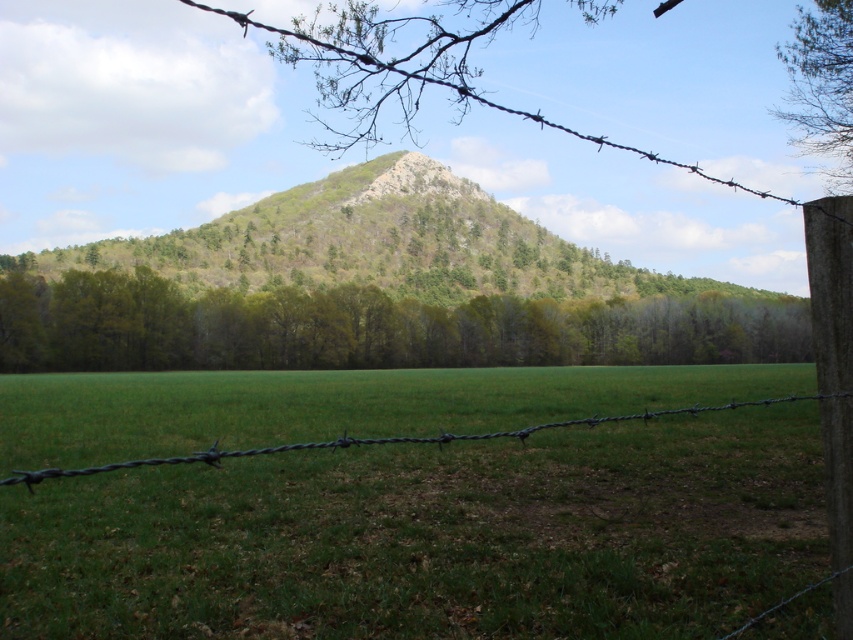
Question: Which of the following is the farthest from the observer?

Choices:
 (A) green grass at center
 (B) green leafy tree at upper right

Answer: (B)

Question: Is green grass at center below green textured hill at center?

Choices:
 (A) yes
 (B) no

Answer: (A)

Question: Which object is farther from the camera taking this photo?

Choices:
 (A) green leafy trees at center
 (B) green leafy tree at upper right

Answer: (A)

Question: Among these points, which one is nearest to the camera?

Choices:
 (A) (691, 538)
 (B) (299, 260)

Answer: (A)

Question: Can you confirm if green grass at center is positioned above green textured hill at center?

Choices:
 (A) yes
 (B) no

Answer: (B)

Question: Observing the image, what is the correct spatial positioning of green grass at center in reference to green textured hill at center?

Choices:
 (A) right
 (B) left

Answer: (B)